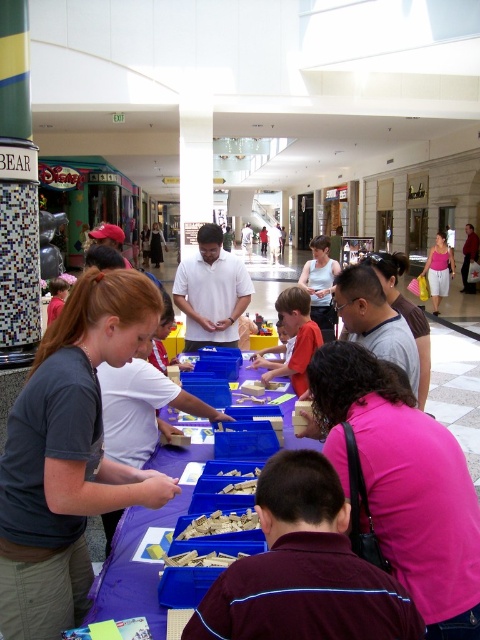
Question: Which point appears farthest from the camera in this image?

Choices:
 (A) (225, 493)
 (B) (279, 292)
 (C) (212, 529)

Answer: (B)

Question: Which point appears farthest from the camera in this image?

Choices:
 (A) (210, 522)
 (B) (282, 321)
 (C) (219, 476)
 (D) (152, 621)

Answer: (B)

Question: Does light brown wooden toy at center have a larger size compared to crumbly yellow cake at center?

Choices:
 (A) no
 (B) yes

Answer: (B)

Question: Which object is farther from the camera taking this photo?

Choices:
 (A) purple plastic table at center
 (B) light brown wooden toy at center

Answer: (B)

Question: Can you confirm if purple plastic table at center is positioned to the right of light brown wooden toy at center?

Choices:
 (A) yes
 (B) no

Answer: (B)

Question: From the image, what is the correct spatial relationship of purple plastic table at center in relation to crumbly yellow cake at center?

Choices:
 (A) below
 (B) above

Answer: (A)